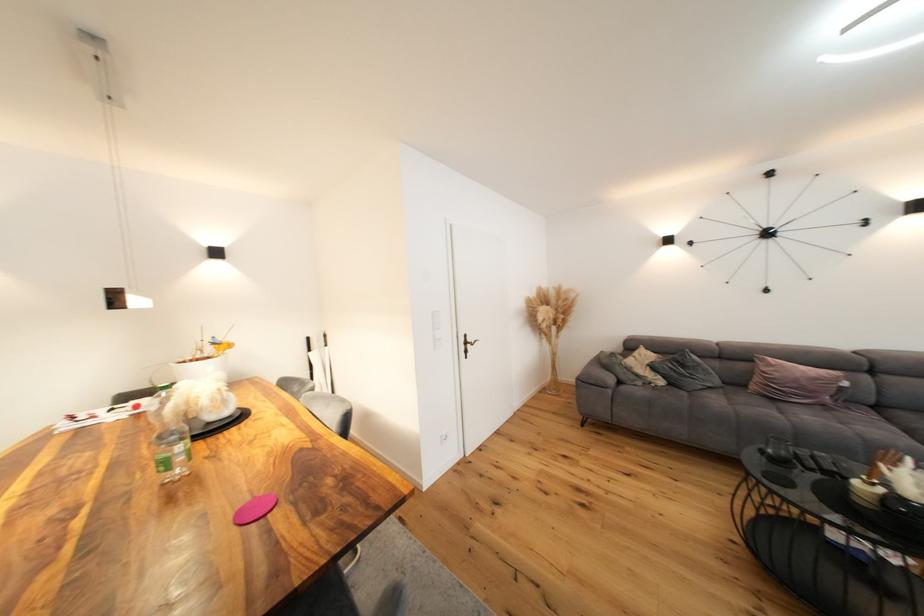
This screenshot has height=616, width=924. Describe the element at coordinates (827, 464) in the screenshot. I see `a black remote control` at that location.